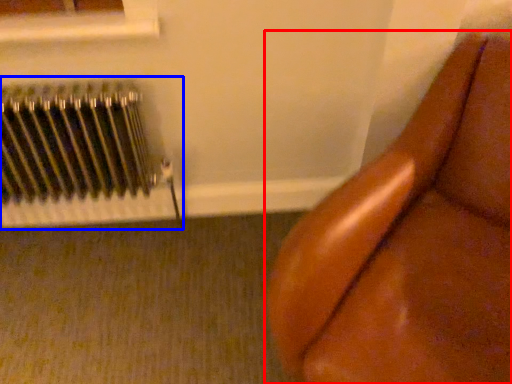
Question: Which point is further to the camera, furniture (highlighted by a red box) or radiator (highlighted by a blue box)?

Choices:
 (A) furniture
 (B) radiator

Answer: (B)